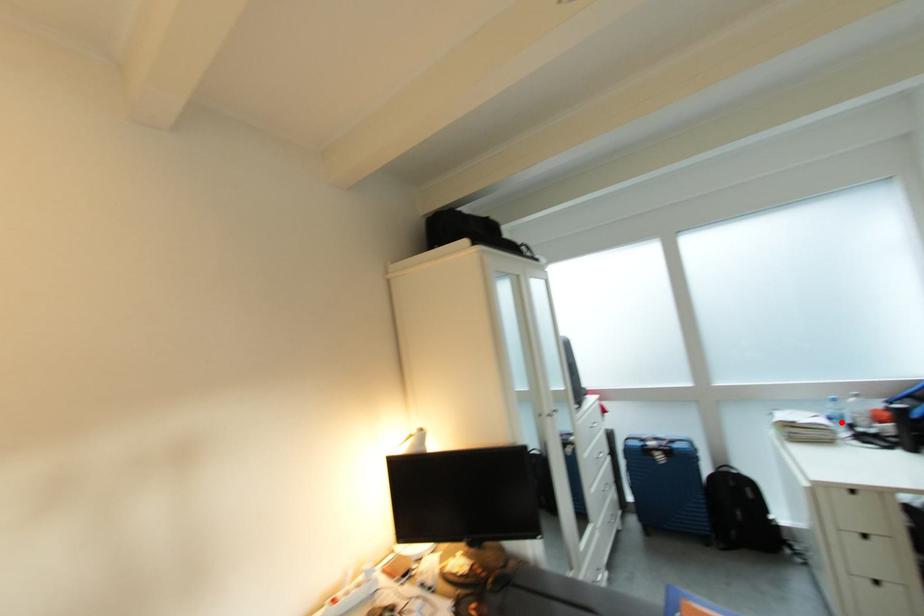
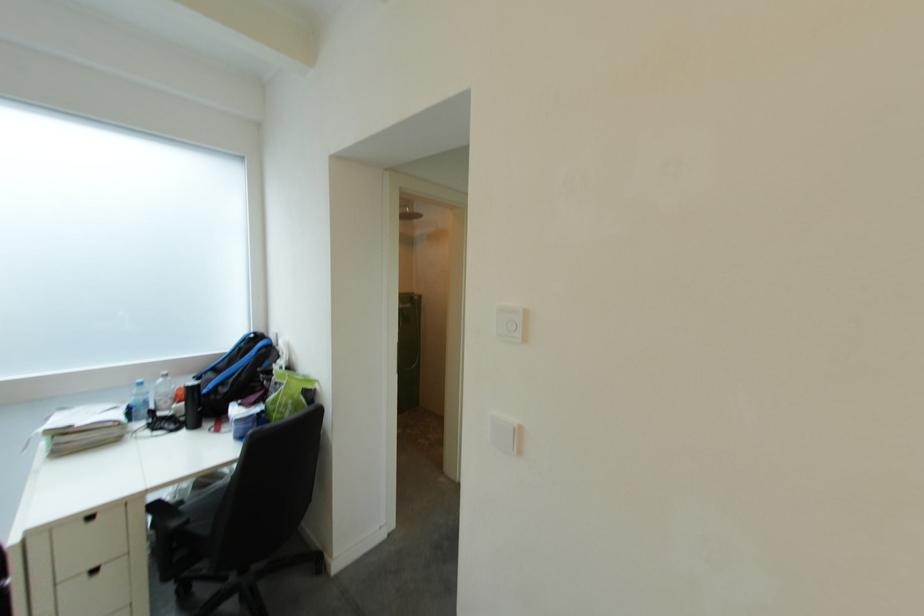
Question: I am providing you with two images of the same scene from different viewpoints. Image1 has a red point marked. In image2, the corresponding 3D location appears at what relative position? Reply with the corresponding letter.

Choices:
 (A) Closer
 (B) Farther

Answer: (B)